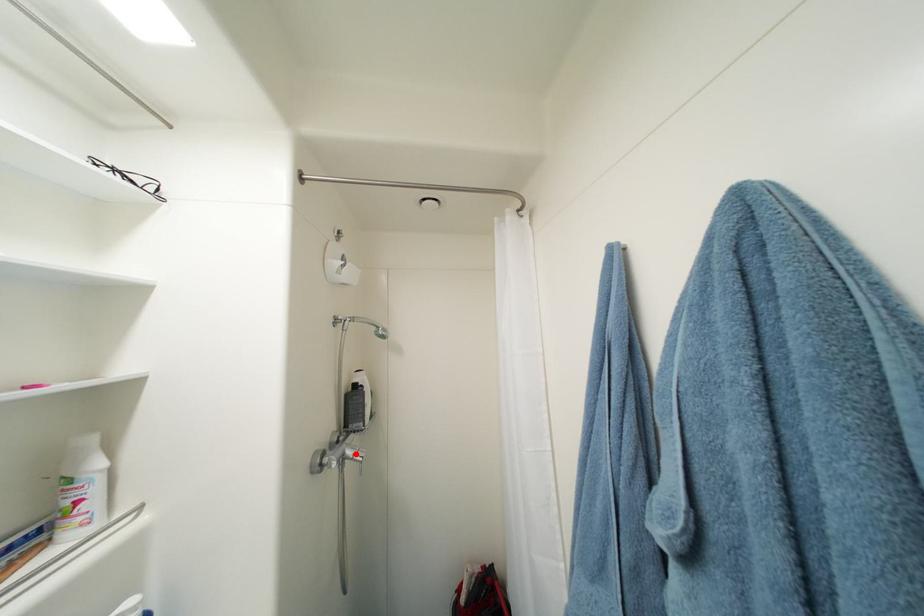
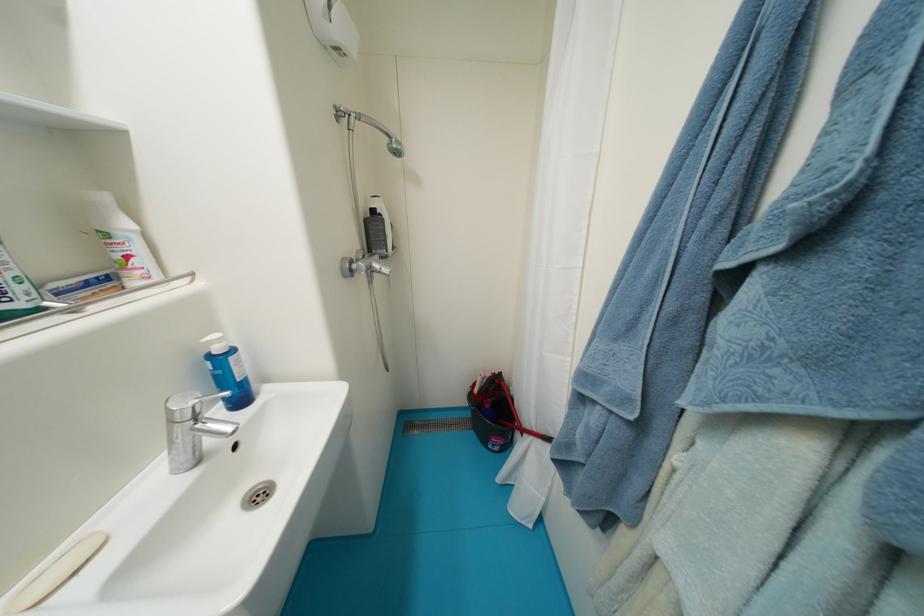
Find the pixel in the second image that matches the highlighted location in the first image.

(383, 267)